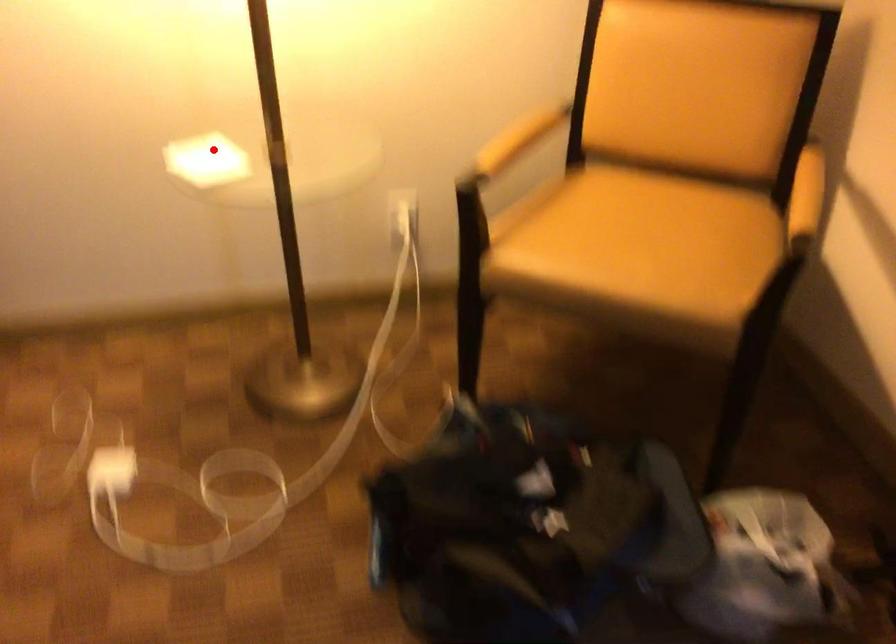
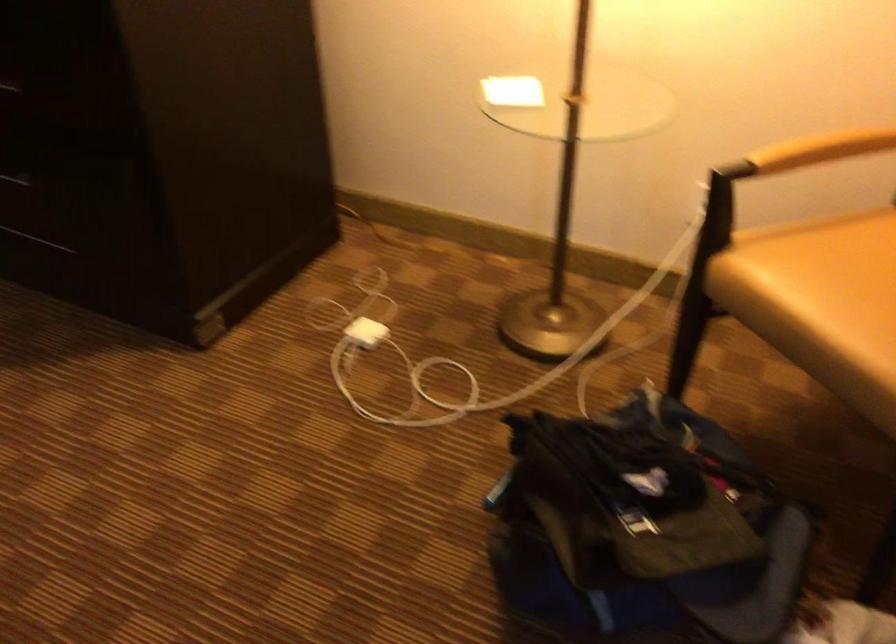
In the second image, find the point that corresponds to the highlighted location in the first image.

(513, 91)